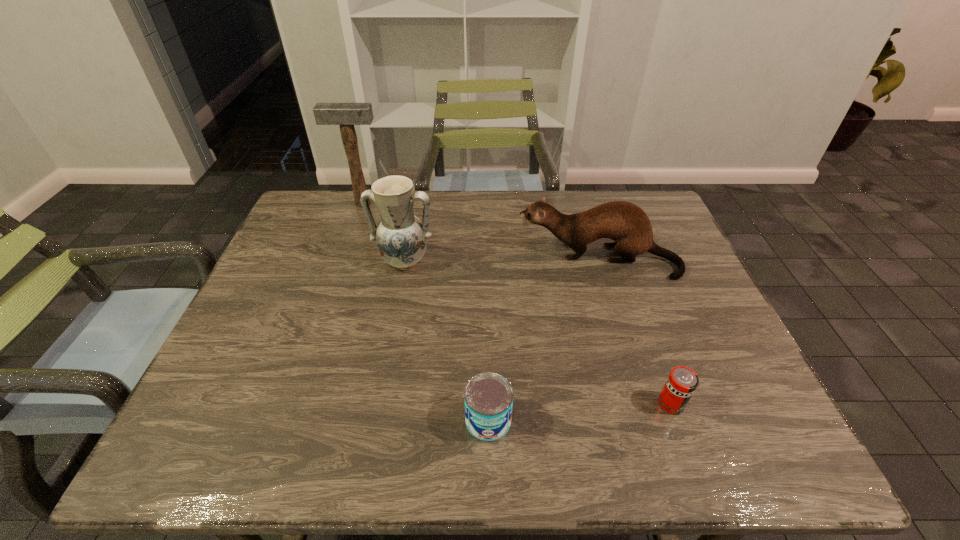
The image size is (960, 540). I want to click on mallet, so click(x=346, y=115).

At what (x,y) coordinates should I click in order to perform the action: click on the farthest object. Please return your answer as a coordinate pair (x, y). The width and height of the screenshot is (960, 540). Looking at the image, I should click on (346, 115).

This screenshot has height=540, width=960. I want to click on pottery, so click(401, 238).

Locate an element on the screen. This screenshot has height=540, width=960. the fourth object from right to left is located at coordinates (401, 238).

This screenshot has height=540, width=960. I want to click on the third tallest object, so click(626, 223).

At what (x,y) coordinates should I click in order to perform the action: click on the right can. Please return your answer as a coordinate pair (x, y). Looking at the image, I should click on (682, 381).

Locate an element on the screen. The image size is (960, 540). the third object from right to left is located at coordinates (488, 396).

Find the location of a particular element. The width and height of the screenshot is (960, 540). free point located on the right of the mallet is located at coordinates (483, 203).

Identify the location of vacant region located 0.390m on either side of the second tallest object. The width and height of the screenshot is (960, 540). (376, 407).

Where is `free space located 0.330m at the face of the third tallest object`? free space located 0.330m at the face of the third tallest object is located at coordinates coord(402,259).